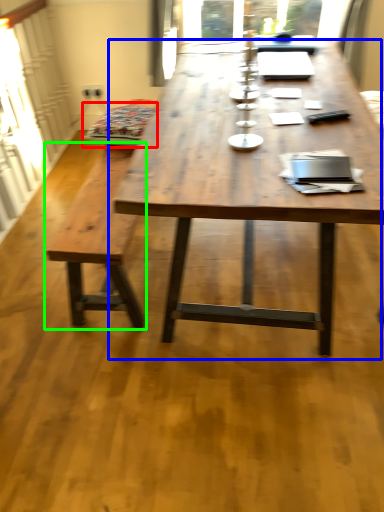
Question: Which object is the farthest from swivel chair (highlighted by a red box)? Choose among these: coffee table (highlighted by a blue box) or bench (highlighted by a green box).

Choices:
 (A) coffee table
 (B) bench

Answer: (A)